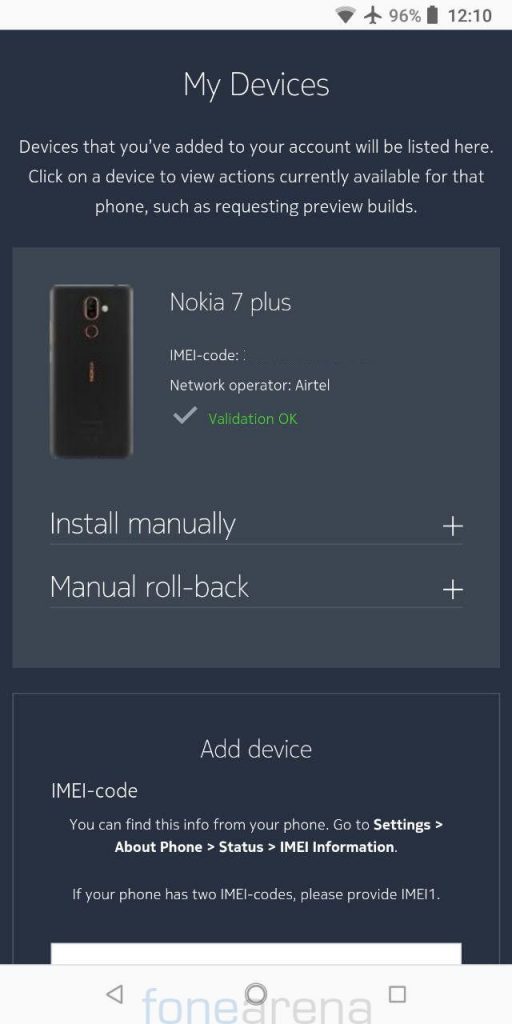
You are a GUI agent. You are given a task and a screenshot of the screen. Output one action in this format:
    pyautogui.click(x=<x>, y=<y>)
    Task: Click on the phone
    
    Given the screenshot: What is the action you would take?
    pyautogui.click(x=74, y=368)